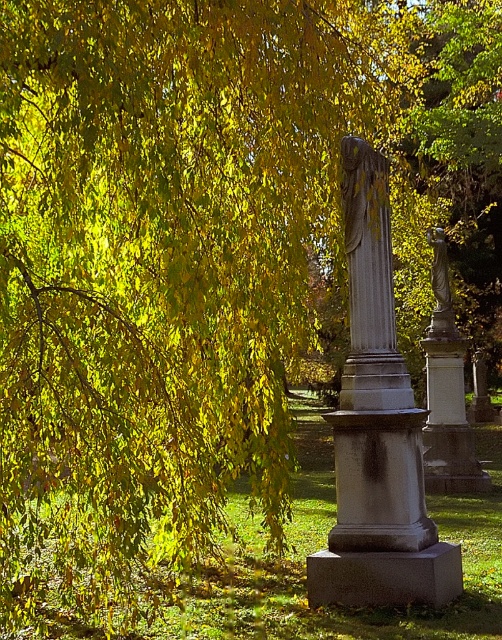
You are an artist planning to sketch this scene. You want to ensure the proportions between the gray stone statue at center and the bronze statue at right are accurate. Based on the scene, which statue should you draw as smaller in your sketch?

The gray stone statue at center should be drawn as smaller compared to the bronze statue at right because the gray stone statue at center has a smaller size compared to bronze statue at right.

You are standing in the cemetery and want to take a photo of the gray stone statue at center and the bronze statue at right. Which statue should you move closer to in order to get both in the frame without zooming?

You should move closer to the gray stone statue at center because it is in front of the bronze statue at right, so moving closer allows both to be captured without zooming.

From the picture: You are a landscape architect planning to place a new bench between the gray stone statue at center and the bronze statue at right. The bench requires at least 1.2 meters of space between the statues to be placed. Based on the scene description, can the bench be placed there?

The gray stone statue at center has a smaller width than the bronze statue at right, but the exact distance between them isn